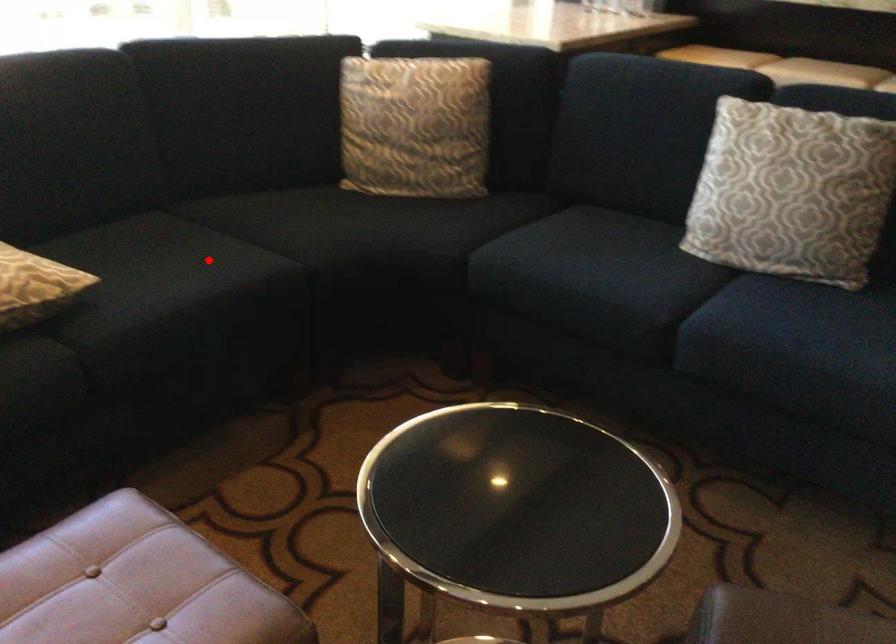
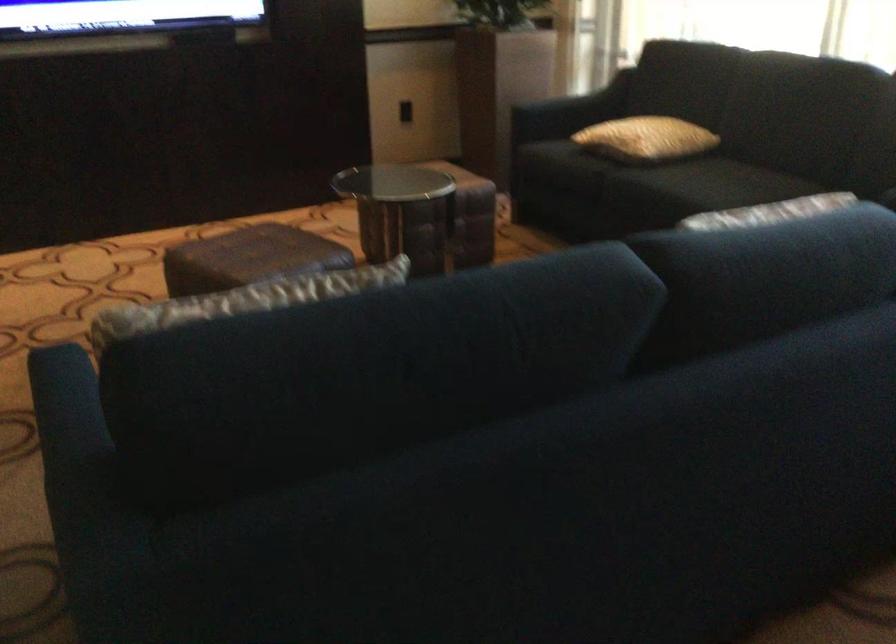
Question: I am providing you with two images of the same scene from different viewpoints. In image1, a red point is highlighted. Considering the same 3D point in image2, which of the following is correct?

Choices:
 (A) It is closer
 (B) It is farther

Answer: (B)